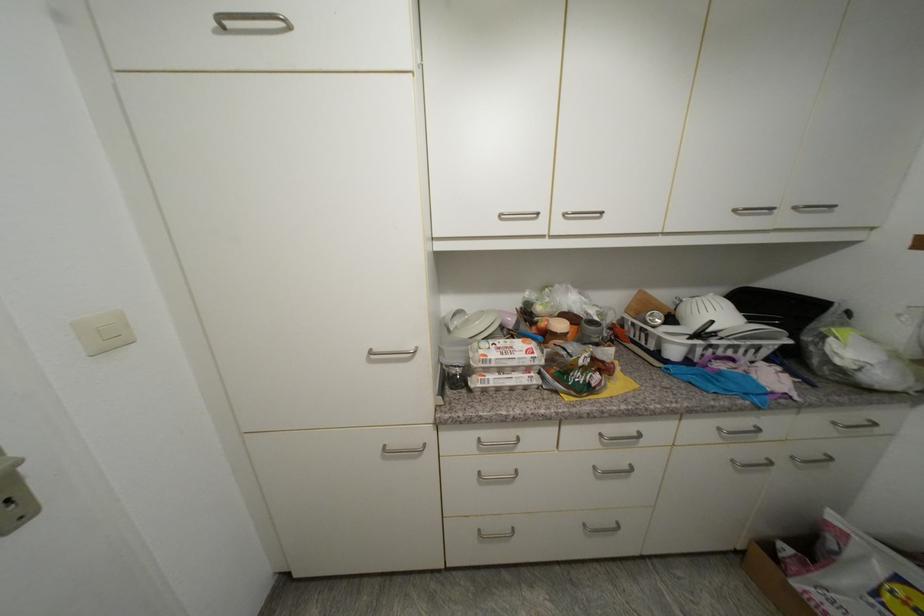
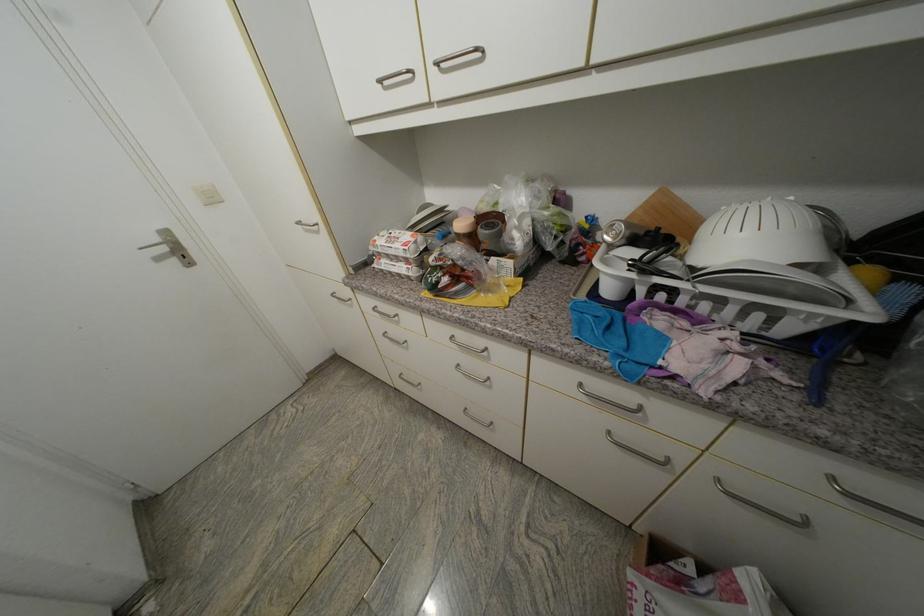
How did the camera likely rotate?

The rotation direction of the camera is left-down.